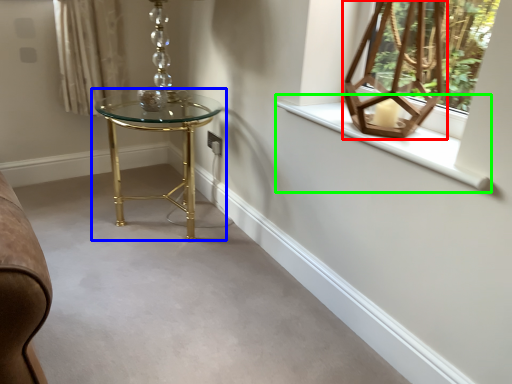
Question: Based on their relative distances, which object is nearer to table lamp (highlighted by a red box)? Choose from table (highlighted by a blue box) and window sill (highlighted by a green box).

Choices:
 (A) table
 (B) window sill

Answer: (B)